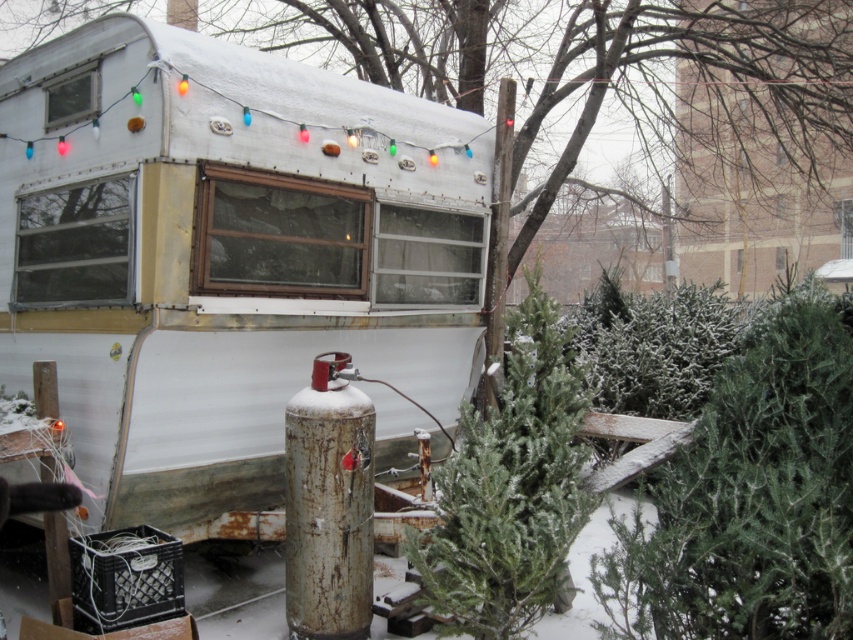
Looking at this image, you are standing at the base of the green textured pine tree at center and want to walk towards the white matte trailer at upper left. Is the trailer above or below your current position?

The white matte trailer at upper left is located above the green textured pine tree at center, so the trailer is above your current position.

Looking at this image, you are standing in front of the snowy trailer and want to determine the relative positions of two points marked in the scene. Which point, point 1 at coordinates (585, 19) or point 2 at coordinates (469, 600), is closer to you?

Point 1 at coordinates (585, 19) is closer to you because it is further to the viewer than point 2 at coordinates (469, 600).